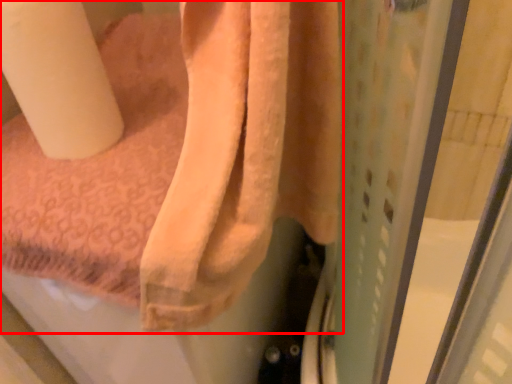
Question: In this image, where is towel (annotated by the red box) located relative to toilet paper?

Choices:
 (A) left
 (B) right

Answer: (B)